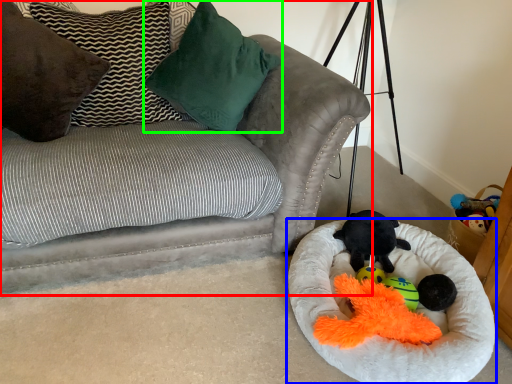
Question: Which is farther away from studio couch (highlighted by a red box)? dog bed (highlighted by a blue box) or pillow (highlighted by a green box)?

Choices:
 (A) dog bed
 (B) pillow

Answer: (A)